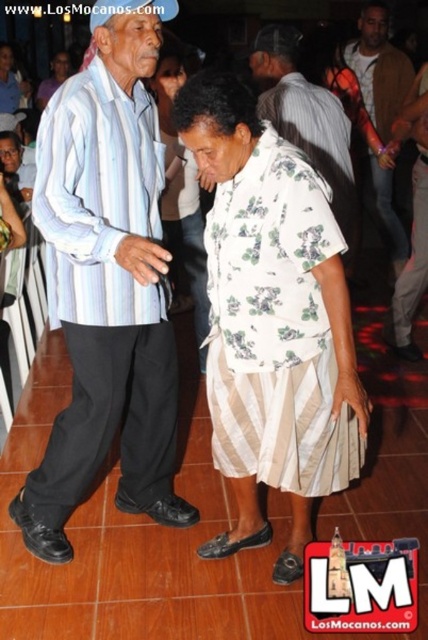
Is point (243, 205) in front of point (422, 211)?

Yes, point (243, 205) is closer to viewer.

Who is positioned more to the right, white floral fabric dress at center or matte black suit at center?

matte black suit at center is more to the right.

Where is `white floral fabric dress at center`? white floral fabric dress at center is located at coordinates point(275,328).

Where is `white floral fabric dress at center`? The image size is (428, 640). white floral fabric dress at center is located at coordinates (275, 328).

Can you confirm if floral shirt at center is bigger than matte black suit at center?

Correct, floral shirt at center is larger in size than matte black suit at center.

Which is in front, point (359, 72) or point (419, 157)?

Point (419, 157) is in front.

Does point (374, 100) lie behind point (409, 342)?

Yes, it is behind point (409, 342).

The height and width of the screenshot is (640, 428). I want to click on floral shirt at center, so click(379, 67).

Is striped cotton shirt at center wider than floral fabric shirt at center?

No, striped cotton shirt at center is not wider than floral fabric shirt at center.

Is striped cotton shirt at center positioned before floral fabric shirt at center?

Yes, striped cotton shirt at center is closer to the viewer.

Between point (94, 346) and point (332, 138), which one is positioned in front?

Point (94, 346)

In order to click on striped cotton shirt at center in this screenshot , I will do `click(107, 284)`.